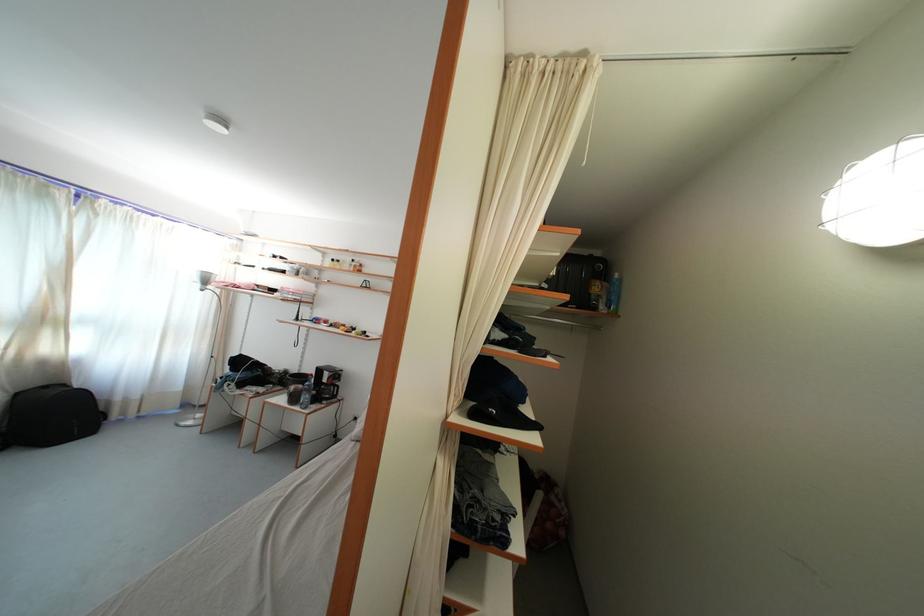
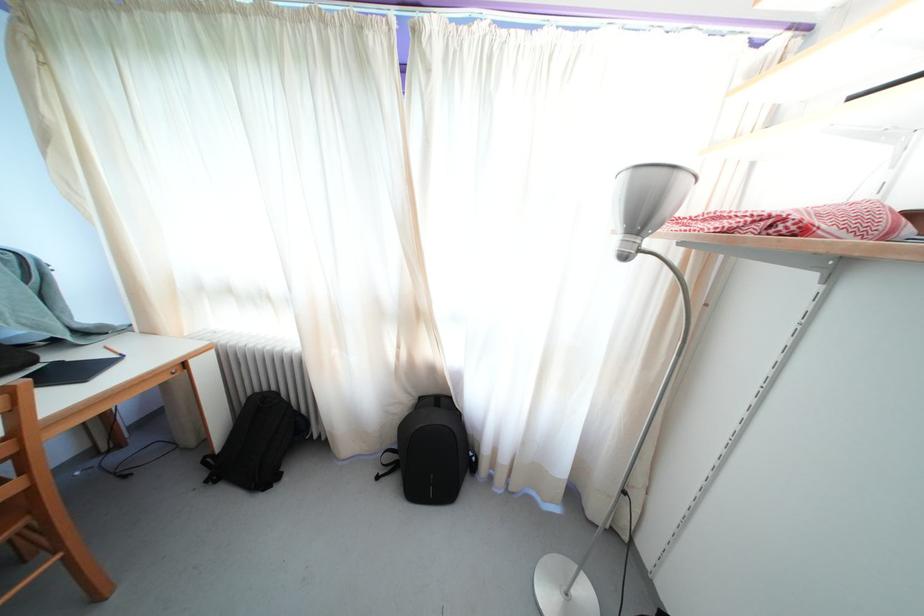
In the second image, find the point that corresponds to point 52,326 in the first image.

(421, 321)